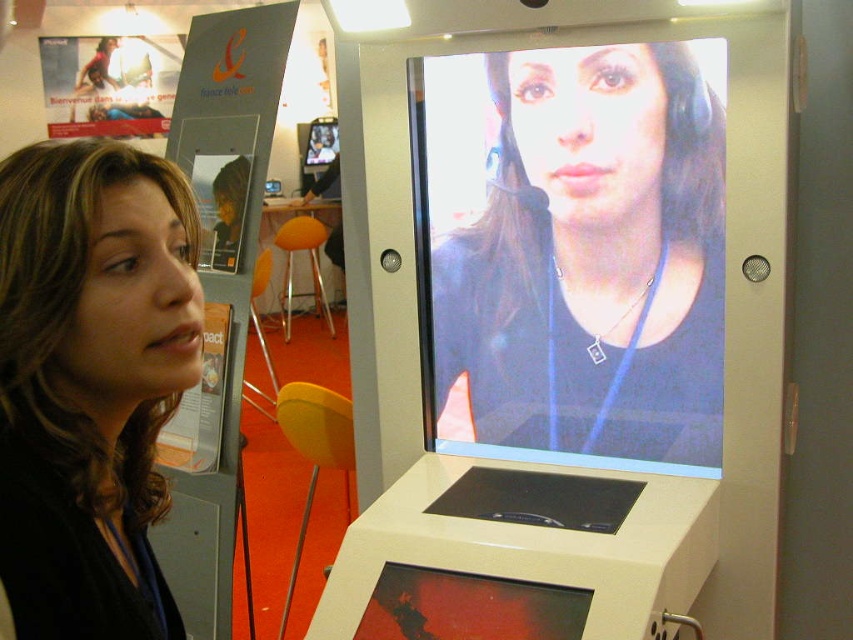
You are a visitor at the exhibition and want to know if the matte black screen at center can be seen clearly from where you are standing. Considering the size of the matte black hair at left, can you determine if the screen is large enough?

The matte black screen at center has a larger size compared to matte black hair at left, so yes, the screen is large enough to be seen clearly from your position.

You are a visitor at the exhibition booth and want to take a photo of the matte black screen at center. However, there is someone with matte black hair at left in your way. Can you move around to avoid them and still capture the screen?

The matte black hair at left is behind the matte black screen at center, so you can move to the side to capture the screen without obstruction from the person behind it.

You are a visitor at the exhibition and want to take a photo of both the matte black screen at center and the matte black hair at left. Your camera has a minimum focus distance of 1 meter. Can you capture both objects in focus without moving closer?

The matte black screen at center and matte black hair at left are 1.07 meters apart. Since the distance between them is just over 1 meter, your camera can focus on both as long as they are within the camera sensor range. However, ensure that both objects are within the camera frame and that the focus is set appropriately for the distance.